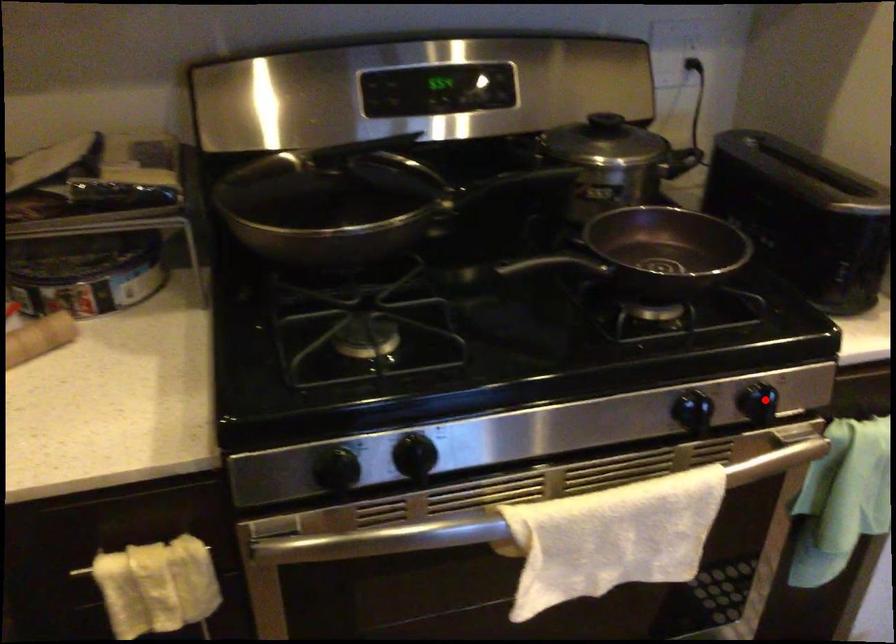
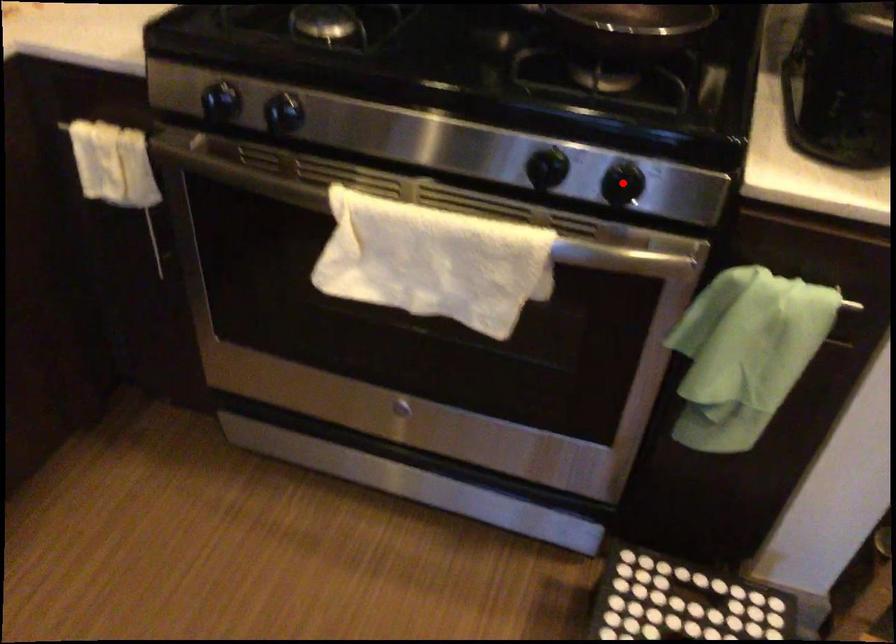
I am providing you with two images of the same scene from different viewpoints. A red point is marked on the first image and another point is marked on the second image. Is the red point in image1 aligned with the point shown in image2?

Yes